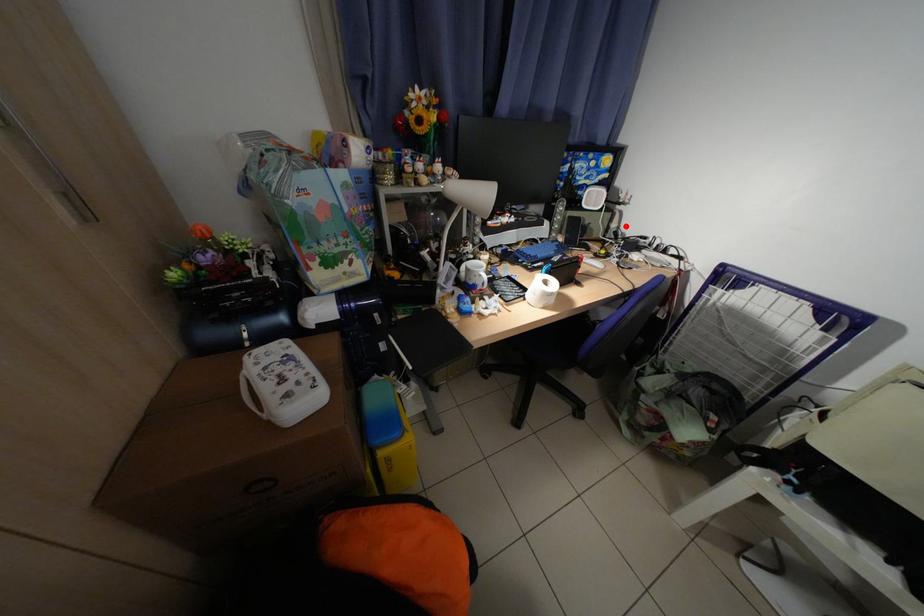
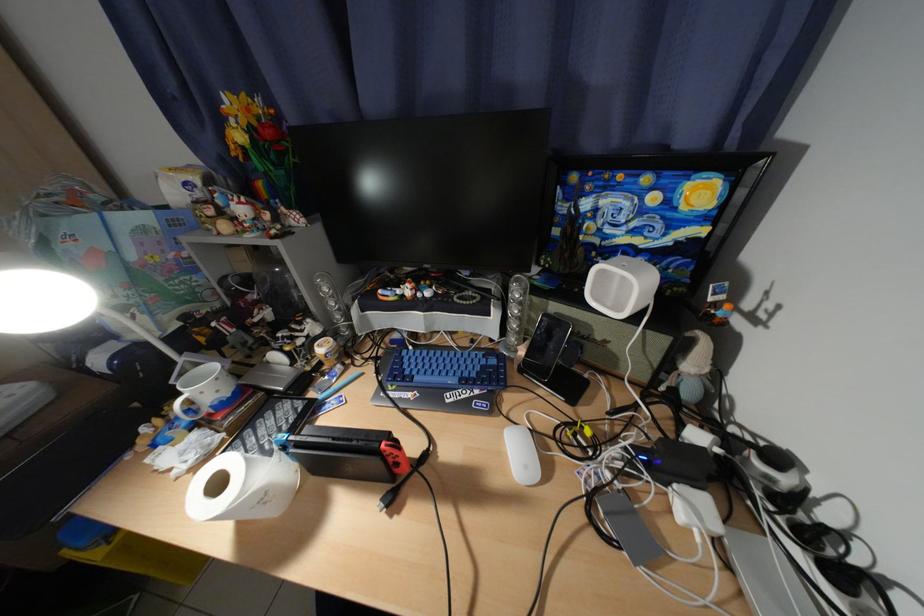
Find the pixel in the second image that matches the highlighted location in the first image.

(704, 367)